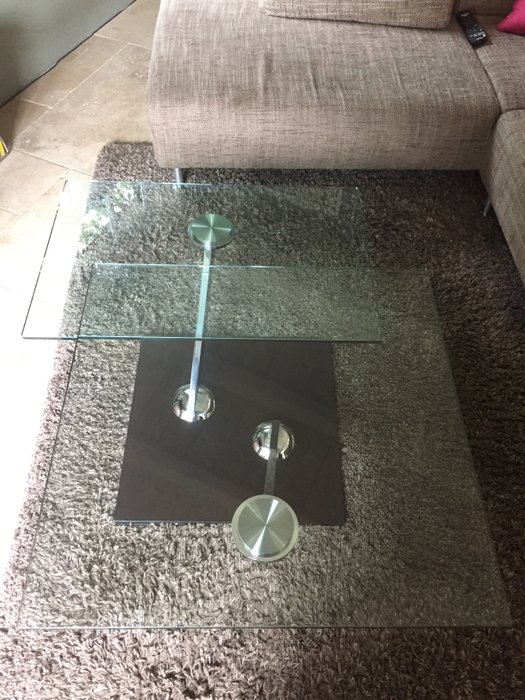
This screenshot has height=700, width=525. I want to click on tan couch back pillow, so click(x=388, y=15).